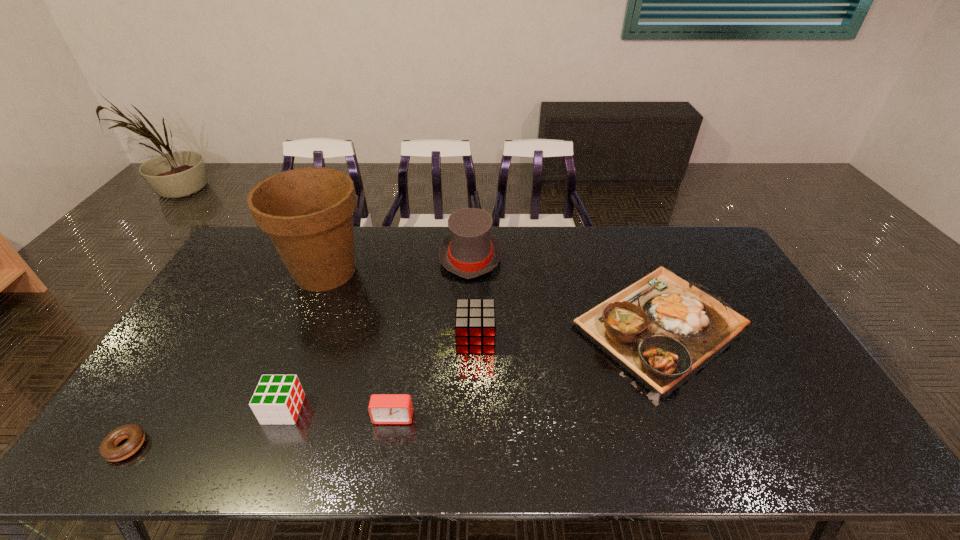
This screenshot has height=540, width=960. In order to click on free area in between the flowerpot and the alarm clock in this screenshot , I will do (x=359, y=345).

Where is `vacant space in between the left cube and the farther cube`? This screenshot has height=540, width=960. vacant space in between the left cube and the farther cube is located at coordinates (379, 374).

You are a GUI agent. You are given a task and a screenshot of the screen. Output one action in this format:
    pyautogui.click(x=<x>, y=<y>)
    Task: Click on the free space between the fourth object from right to left and the third tallest object
    This screenshot has width=960, height=540.
    Given the screenshot: What is the action you would take?
    pyautogui.click(x=435, y=378)

Where is `vacant region between the alarm clock and the right cube`? vacant region between the alarm clock and the right cube is located at coordinates (435, 378).

Where is `vacant area that lies between the platter and the tallest object`? Image resolution: width=960 pixels, height=540 pixels. vacant area that lies between the platter and the tallest object is located at coordinates (492, 299).

Image resolution: width=960 pixels, height=540 pixels. In order to click on vacant space that is in between the dress hat and the nearer cube in this screenshot , I will do `click(377, 333)`.

Identify the location of unoccupied position between the rightmost object and the farther cube. (567, 333).

I want to click on vacant space in between the dress hat and the farther cube, so click(x=473, y=298).

Identify which object is the sixth closest to the rightmost object. Please provide its 2D coordinates. Your answer should be formatted as a tuple, i.e. [(x, y)], where the tuple contains the x and y coordinates of a point satisfying the conditions above.

[(108, 449)]

Locate an element on the screen. This screenshot has height=540, width=960. object that can be found as the fifth closest to the left cube is located at coordinates (469, 251).